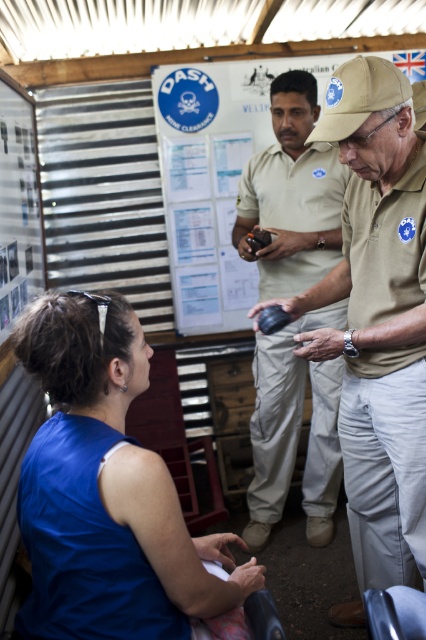
You are a safety inspector standing at the front of the room. You need to check if the blue sleeveless top at lower left is within the 1.2 meters safety zone. Is it within the zone?

The blue sleeveless top at lower left is 1.13 meters from viewer, so yes, it is within the 1.2 meters safety zone.

Where is the tan uniform at center located?

The tan uniform at center is located at point 0.497 on the x axis and 0.885 on the y axis.